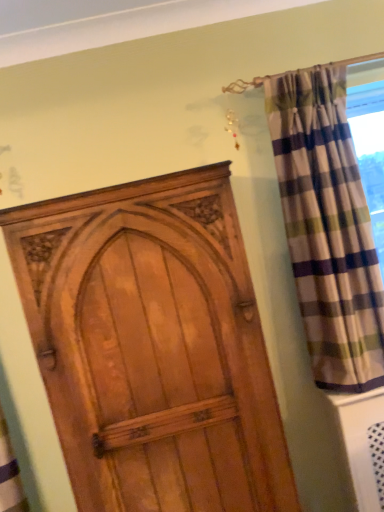
Question: Is wooden door at center situated inside plaid fabric curtain at right or outside?

Choices:
 (A) inside
 (B) outside

Answer: (B)

Question: From a real-world perspective, relative to plaid fabric curtain at right, is wooden door at center vertically above or below?

Choices:
 (A) above
 (B) below

Answer: (B)

Question: From the image's perspective, relative to plaid fabric curtain at right, is wooden door at center above or below?

Choices:
 (A) below
 (B) above

Answer: (A)

Question: From the image's perspective, is plaid fabric curtain at right positioned above or below wooden door at center?

Choices:
 (A) below
 (B) above

Answer: (B)

Question: Is plaid fabric curtain at right taller or shorter than wooden door at center?

Choices:
 (A) tall
 (B) short

Answer: (B)

Question: Is plaid fabric curtain at right wider or thinner than wooden door at center?

Choices:
 (A) thin
 (B) wide

Answer: (A)

Question: From a real-world perspective, relative to wooden door at center, is plaid fabric curtain at right vertically above or below?

Choices:
 (A) above
 (B) below

Answer: (A)